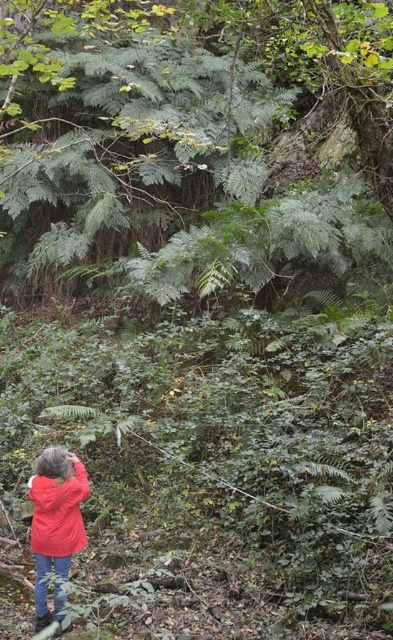
Question: Is green leafy tree at upper center bigger than red matte jacket at lower left?

Choices:
 (A) no
 (B) yes

Answer: (B)

Question: Is green leafy tree at upper center smaller than red matte jacket at lower left?

Choices:
 (A) yes
 (B) no

Answer: (B)

Question: Which point is farther from the camera taking this photo?

Choices:
 (A) (38, 566)
 (B) (295, 36)

Answer: (B)

Question: Which of the following is the farthest from the observer?

Choices:
 (A) (280, 214)
 (B) (45, 598)

Answer: (A)

Question: Can you confirm if green leafy tree at upper center is positioned to the right of red matte jacket at lower left?

Choices:
 (A) yes
 (B) no

Answer: (A)

Question: Among these points, which one is farthest from the camera?

Choices:
 (A) (51, 504)
 (B) (124, 42)

Answer: (B)